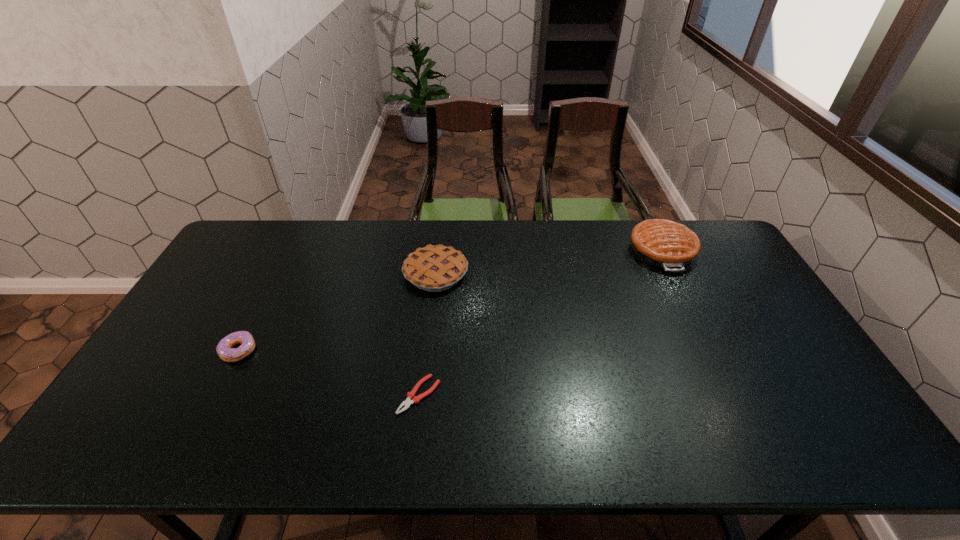
Identify which object is the second closest to the second nearest object. Please provide its 2D coordinates. Your answer should be formatted as a tuple, i.e. [(x, y)], where the tuple contains the x and y coordinates of a point satisfying the conditions above.

[(411, 398)]

Identify the location of vacant space that satisfies the following two spatial constraints: 1. on the back side of the third shortest object; 2. on the left side of the taller pie. (439, 251).

Identify the location of vacant space that satisfies the following two spatial constraints: 1. on the back side of the right pie; 2. on the left side of the third shortest object. The height and width of the screenshot is (540, 960). (439, 251).